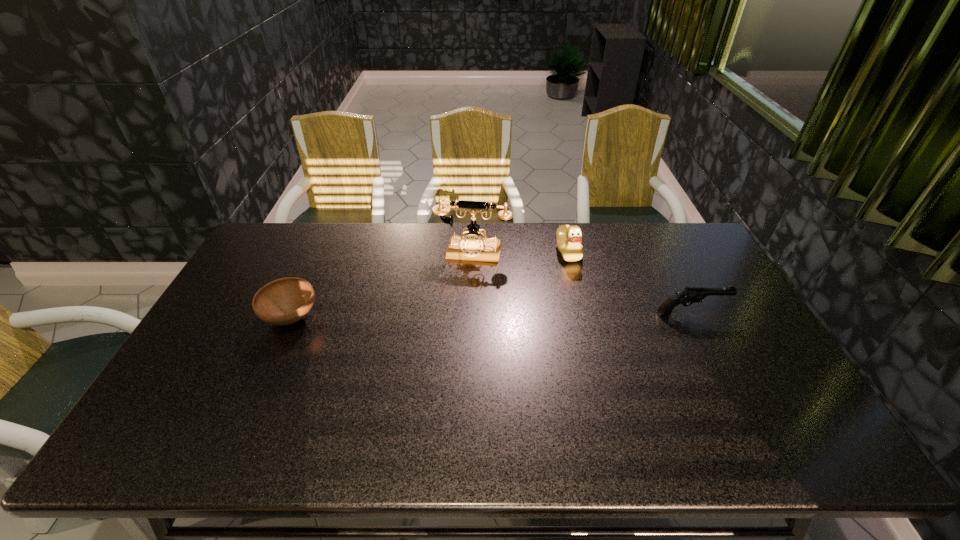
You are a GUI agent. You are given a task and a screenshot of the screen. Output one action in this format:
    pyautogui.click(x=<x>, y=<y>)
    Task: Click on the vacant space on the desktop that is between the bowl and the rightmost object and is positioned on the dial of the telephone
    This screenshot has width=960, height=540.
    Given the screenshot: What is the action you would take?
    pyautogui.click(x=458, y=316)

Where is `vacant space on the desktop that is between the leftmost object and the rightmost object and is positioned at the beak of the second object from right to left`? The image size is (960, 540). vacant space on the desktop that is between the leftmost object and the rightmost object and is positioned at the beak of the second object from right to left is located at coordinates (495, 315).